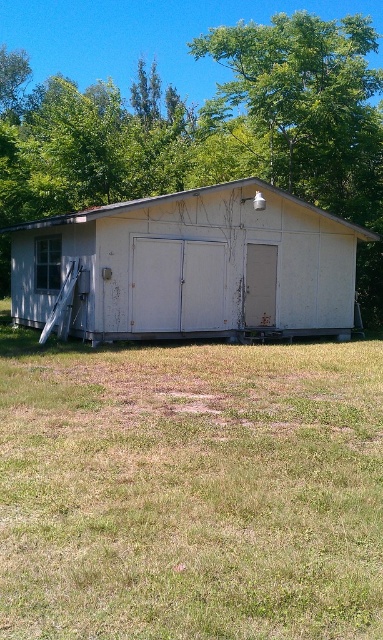
You are standing in the grassy area near the white matte shed at center and want to enter the smaller door on its right side. To do so, you need to walk around the green leafy tree at upper center. Which direction should you walk to reach the shed without going through the tree?

You should walk around the green leafy tree at upper center to the right side since the white matte shed at center is behind it, so going around the right side of the tree would allow you to access the shed and its smaller door.